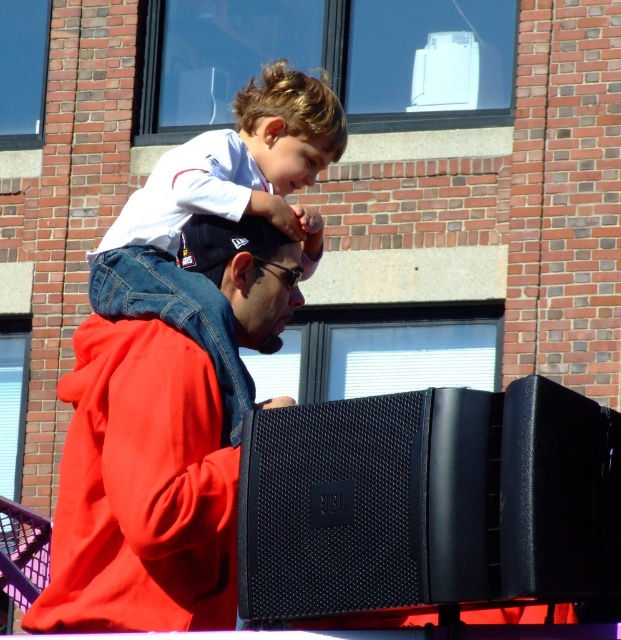
Can you confirm if black mesh speaker at lower right is smaller than matte red hoodie at center?

Indeed, black mesh speaker at lower right has a smaller size compared to matte red hoodie at center.

Is black mesh speaker at lower right bigger than matte red hoodie at center?

No.

Describe the element at coordinates (428, 500) in the screenshot. I see `black mesh speaker at lower right` at that location.

Where is `black mesh speaker at lower right`? black mesh speaker at lower right is located at coordinates (428, 500).

In order to click on black mesh speaker at lower right in this screenshot , I will do `click(428, 500)`.

Can you confirm if black mesh speaker at lower right is wider than white matte shirt at upper center?

No, black mesh speaker at lower right is not wider than white matte shirt at upper center.

The height and width of the screenshot is (640, 621). Find the location of `black mesh speaker at lower right`. black mesh speaker at lower right is located at coordinates (428, 500).

Does matte red hoodie at center appear on the left side of white matte shirt at upper center?

No, matte red hoodie at center is not to the left of white matte shirt at upper center.

Is matte red hoodie at center bigger than white matte shirt at upper center?

Incorrect, matte red hoodie at center is not larger than white matte shirt at upper center.

Is point (176, 365) farther from viewer compared to point (304, 131)?

No, it is in front of (304, 131).

Locate an element on the screen. This screenshot has height=640, width=621. matte red hoodie at center is located at coordinates (142, 486).